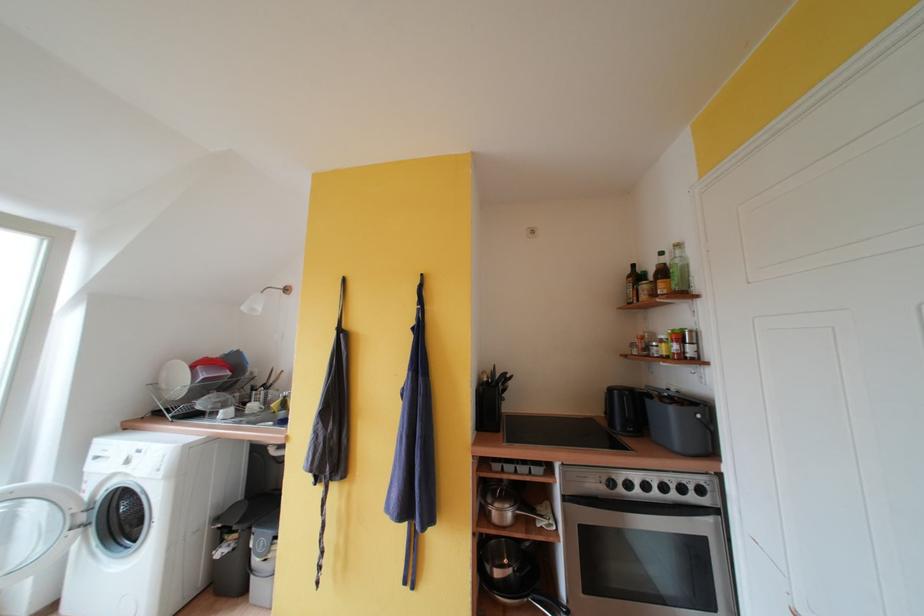
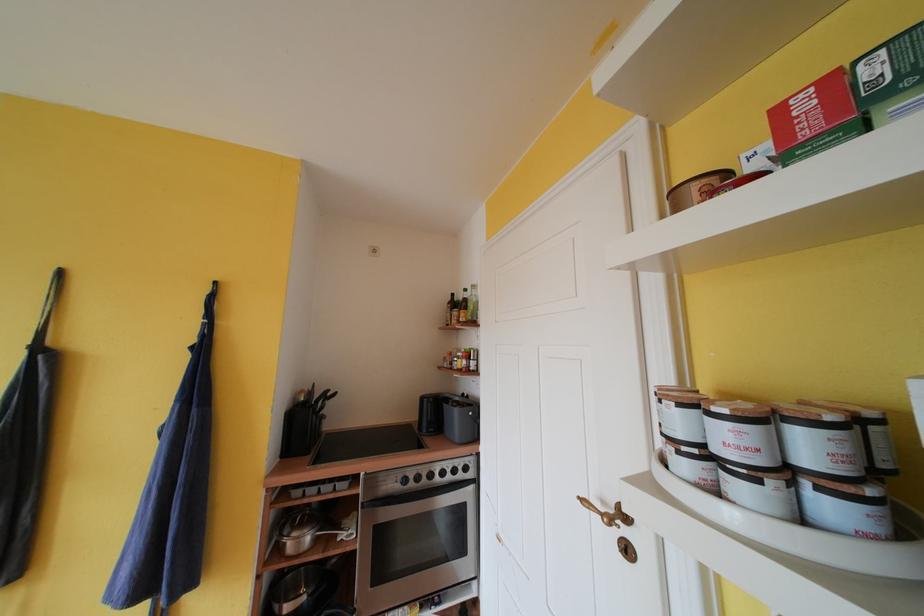
Question: The camera is either moving clockwise (left) or counter-clockwise (right) around the object. The first image is from the beginning of the video and the second image is from the end. Is the camera moving left or right when shooting the video?

Choices:
 (A) Left
 (B) Right

Answer: (A)